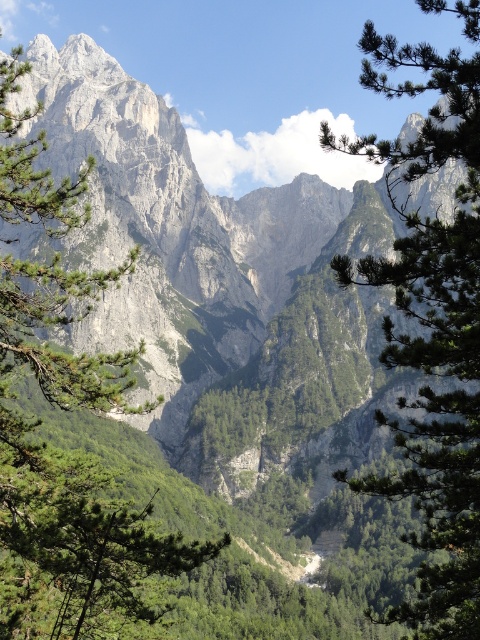
You are standing at the center of the scene and want to take a photo of the green leafy tree at left. In which direction should you move to get a better view of it?

The green leafy tree at left is located at point (x=72, y=476), which means it is positioned to the left and slightly forward in the scene. To get a better view, you should move to the left and slightly forward to align with its position.